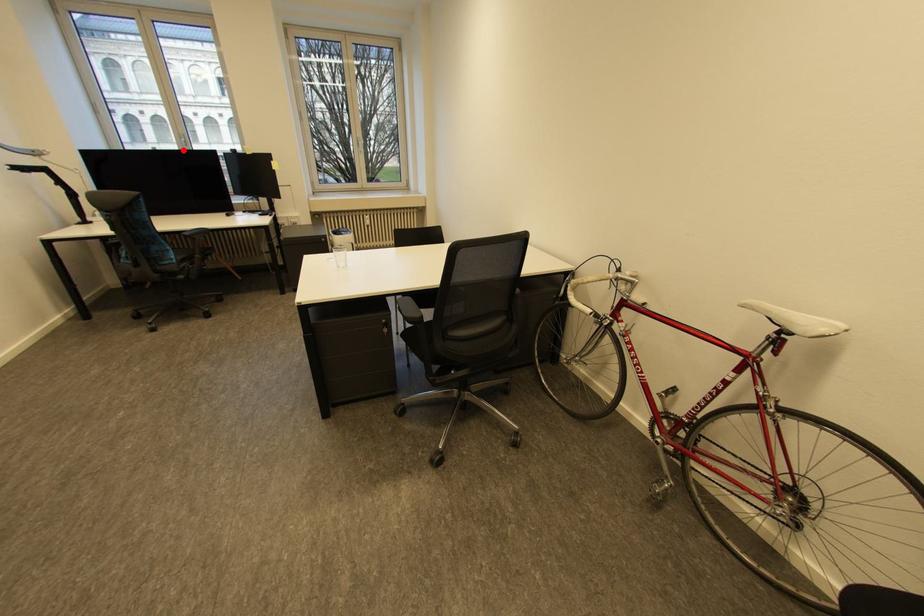
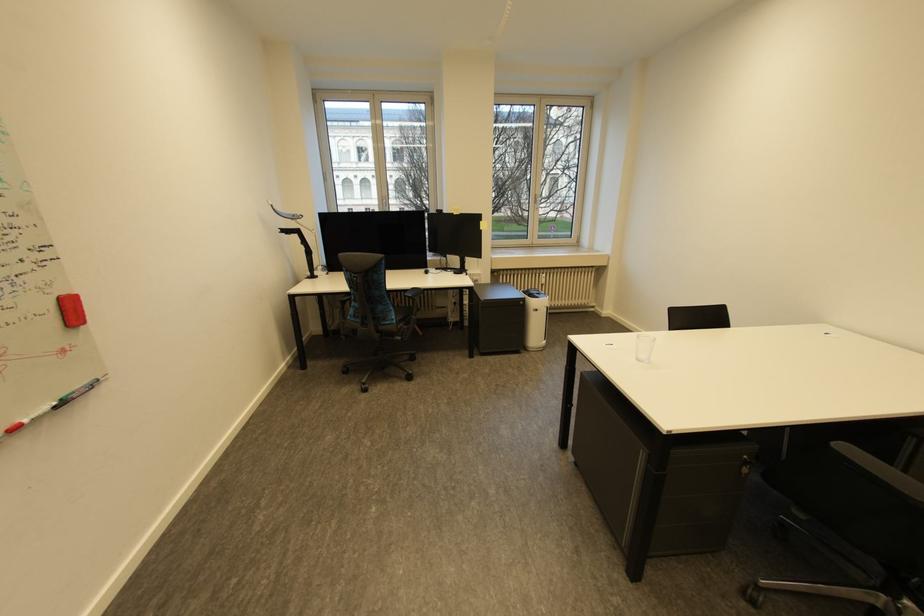
Where in the second image is the point corresponding to the highlighted location from the first image?

(383, 209)